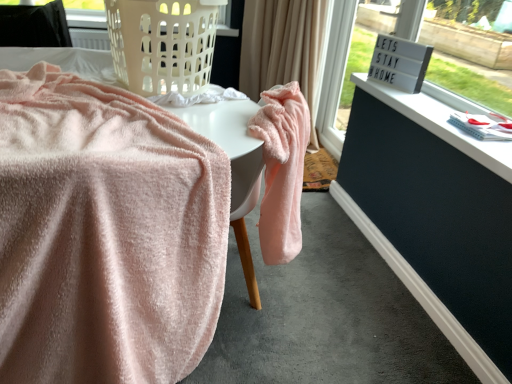
The image size is (512, 384). What do you see at coordinates (234, 166) in the screenshot?
I see `soft pink towel at center, the 2th table viewed from the right` at bounding box center [234, 166].

What do you see at coordinates (435, 216) in the screenshot? This screenshot has height=384, width=512. I see `dark blue painted wood dresser at lower right` at bounding box center [435, 216].

What is the approximate height of beige fabric curtain at upper center?

It is 38.26 inches.

The height and width of the screenshot is (384, 512). Find the location of `black fabric at upper left`. black fabric at upper left is located at coordinates (34, 25).

Identify the location of soft pink towel at center, the 2th table viewed from the right. Image resolution: width=512 pixels, height=384 pixels. (234, 166).

From a real-world perspective, is velvet pink table at center, the second table viewed from the left, physically located above or below soft pink towel at center, the 2th table viewed from the right?

velvet pink table at center, the second table viewed from the left, is above soft pink towel at center, the 2th table viewed from the right.

Based on their sizes in the image, would you say velvet pink table at center, the second table viewed from the left, is bigger or smaller than soft pink towel at center, the 2th table viewed from the right?

In the image, velvet pink table at center, the second table viewed from the left, appears to be smaller than soft pink towel at center, the 2th table viewed from the right.

Is soft pink towel at center, the 2th table viewed from the right, completely or partially inside velvet pink table at center, which is the 1th table from right to left?

No.

Is velvet pink table at center, the second table viewed from the left, thinner than soft pink towel at center, arranged as the 1th table when viewed from the left?

Correct, the width of velvet pink table at center, the second table viewed from the left, is less than that of soft pink towel at center, arranged as the 1th table when viewed from the left.

Consider the image. Does black fabric at upper left touch dark blue painted wood dresser at lower right?

No, black fabric at upper left is not touching dark blue painted wood dresser at lower right.

Which of these two, black fabric at upper left or dark blue painted wood dresser at lower right, stands taller?

black fabric at upper left is taller.

Locate an element on the screen. furniture above the dark blue painted wood dresser at lower right (from a real-world perspective) is located at coordinates 34,25.

From a real-world perspective, which is physically above, black fabric at upper left or dark blue painted wood dresser at lower right?

From a 3D spatial view, black fabric at upper left is above.

Is white plastic laundry basket at upper left positioned in front of dark blue painted wood dresser at lower right?

Yes, the depth of white plastic laundry basket at upper left is less than that of dark blue painted wood dresser at lower right.

Considering the sizes of objects white plastic laundry basket at upper left and dark blue painted wood dresser at lower right in the image provided, who is thinner, white plastic laundry basket at upper left or dark blue painted wood dresser at lower right?

dark blue painted wood dresser at lower right is thinner.

Is white plastic laundry basket at upper left located outside dark blue painted wood dresser at lower right?

Yes.

From a real-world perspective, is dark blue painted wood dresser at lower right located higher than black fabric at upper left?

No, from a real-world perspective, dark blue painted wood dresser at lower right is not over black fabric at upper left

Which object is further away from the camera taking this photo, dark blue painted wood dresser at lower right or black fabric at upper left?

Positioned behind is black fabric at upper left.

Is point (500, 219) positioned before point (17, 26)?

Yes, it is in front of point (17, 26).

Looking at this image, between black fabric at upper left and soft pink towel at center, arranged as the 1th table when viewed from the left, which one has more height?

soft pink towel at center, arranged as the 1th table when viewed from the left.

Is the depth of black fabric at upper left greater than that of soft pink towel at center, arranged as the 1th table when viewed from the left?

Yes, black fabric at upper left is further from the camera.

Is black fabric at upper left bigger than soft pink towel at center, arranged as the 1th table when viewed from the left?

No.

From the image's perspective, does black fabric at upper left appear lower than soft pink towel at center, the 2th table viewed from the right?

No, from the image's perspective, black fabric at upper left is not beneath soft pink towel at center, the 2th table viewed from the right.

Are beige fabric curtain at upper center and dark blue painted wood dresser at lower right located far from each other?

No, beige fabric curtain at upper center is not far away from dark blue painted wood dresser at lower right.

Locate an element on the screen. dresser that appears below the beige fabric curtain at upper center (from a real-world perspective) is located at coordinates (435, 216).

Consider the image. Could you tell me if beige fabric curtain at upper center is facing dark blue painted wood dresser at lower right?

No, beige fabric curtain at upper center is not turned towards dark blue painted wood dresser at lower right.

Would you say dark blue painted wood dresser at lower right is part of beige fabric curtain at upper center's contents?

No, dark blue painted wood dresser at lower right is not inside beige fabric curtain at upper center.

Is black fabric at upper left next to beige fabric curtain at upper center?

No.

Considering the sizes of objects black fabric at upper left and beige fabric curtain at upper center in the image provided, who is thinner, black fabric at upper left or beige fabric curtain at upper center?

With smaller width is black fabric at upper left.

Locate an element on the screen. This screenshot has width=512, height=384. furniture below the beige fabric curtain at upper center (from the image's perspective) is located at coordinates (34, 25).

The image size is (512, 384). Find the location of `table directly beneath the velvet pink table at center, which is the 1th table from right to left (from a real-world perspective)`. table directly beneath the velvet pink table at center, which is the 1th table from right to left (from a real-world perspective) is located at coordinates (234, 166).

Where is `dresser that appears below the black fabric at upper left (from the image's perspective)`? This screenshot has width=512, height=384. dresser that appears below the black fabric at upper left (from the image's perspective) is located at coordinates (435, 216).

Considering their positions, is soft pink towel at center, the 2th table viewed from the right, positioned further to white matte window sill at upper right than white plastic laundry basket at upper left?

The object further to white matte window sill at upper right is white plastic laundry basket at upper left.

Based on their spatial positions, is white matte window sill at upper right or beige fabric curtain at upper center closer to black fabric at upper left?

Among the two, beige fabric curtain at upper center is located nearer to black fabric at upper left.

Estimate the real-world distances between objects in this image. Which object is further from soft pink towel at center, arranged as the 1th table when viewed from the left, black fabric at upper left or beige fabric curtain at upper center?

Among the two, beige fabric curtain at upper center is located further to soft pink towel at center, arranged as the 1th table when viewed from the left.

In the scene shown: Considering their positions, is dark blue painted wood dresser at lower right positioned closer to soft pink towel at center, the 2th table viewed from the right, than beige fabric curtain at upper center?

dark blue painted wood dresser at lower right lies closer to soft pink towel at center, the 2th table viewed from the right, than the other object.

Based on their spatial positions, is soft pink towel at center, the 2th table viewed from the right, or beige fabric curtain at upper center further from white plastic laundry basket at upper left?

beige fabric curtain at upper center is positioned further to the anchor white plastic laundry basket at upper left.

Looking at the image, which one is located closer to dark blue painted wood dresser at lower right, black fabric at upper left or velvet pink table at center, which is the 1th table from right to left?

The object closer to dark blue painted wood dresser at lower right is velvet pink table at center, which is the 1th table from right to left.

Considering their positions, is beige fabric curtain at upper center positioned further to soft pink towel at center, the 2th table viewed from the right, than black fabric at upper left?

beige fabric curtain at upper center lies further to soft pink towel at center, the 2th table viewed from the right, than the other object.

Considering their positions, is velvet pink table at center, the second table viewed from the left, positioned closer to white matte window sill at upper right than dark blue painted wood dresser at lower right?

Based on the image, dark blue painted wood dresser at lower right appears to be nearer to white matte window sill at upper right.

Image resolution: width=512 pixels, height=384 pixels. I want to click on dresser located between white matte window sill at upper right and beige fabric curtain at upper center in the depth direction, so pyautogui.click(x=435, y=216).

Identify the location of table located between soft pink towel at center, the 2th table viewed from the right, and black fabric at upper left in the depth direction. (232, 164).

The width and height of the screenshot is (512, 384). Identify the location of window sill located between white plastic laundry basket at upper left and beige fabric curtain at upper center in the depth direction. (443, 121).

The height and width of the screenshot is (384, 512). I want to click on table between soft pink towel at center, arranged as the 1th table when viewed from the left, and dark blue painted wood dresser at lower right, in the horizontal direction, so click(232, 164).